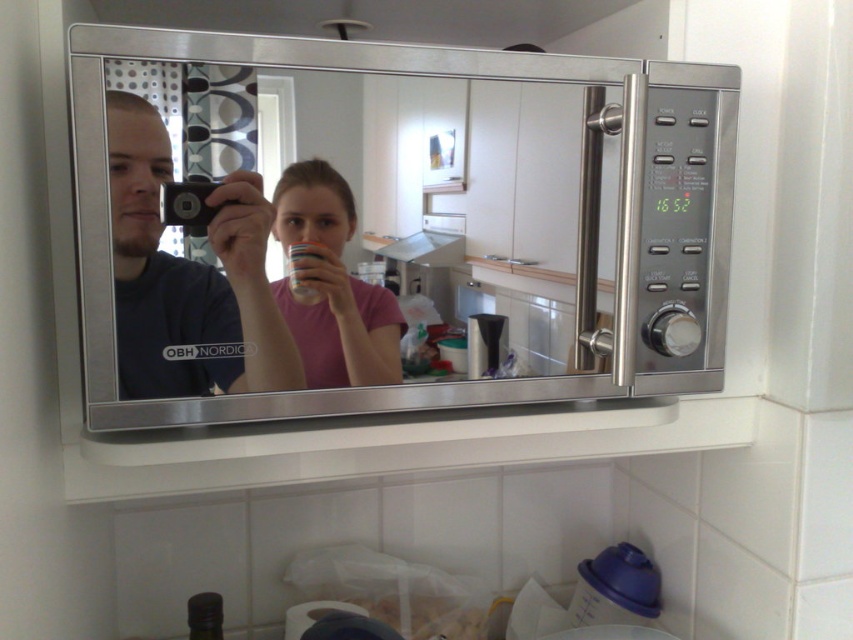
Question: Is matte black camera at center below pink matte shirt at center?

Choices:
 (A) no
 (B) yes

Answer: (A)

Question: Does stainless steel microwave at upper center appear on the left side of white matte cup at upper center?

Choices:
 (A) yes
 (B) no

Answer: (B)

Question: Estimate the real-world distances between objects in this image. Which object is farther from the pink matte shirt at center?

Choices:
 (A) matte black camera at center
 (B) stainless steel microwave at upper center
 (C) white matte cup at upper center

Answer: (B)

Question: Which point is closer to the camera?

Choices:
 (A) pink matte shirt at center
 (B) stainless steel microwave at upper center
 (C) white matte cup at upper center

Answer: (B)

Question: Is stainless steel microwave at upper center positioned in front of matte black camera at center?

Choices:
 (A) no
 (B) yes

Answer: (B)

Question: Which object is farther from the camera taking this photo?

Choices:
 (A) stainless steel microwave at upper center
 (B) pink matte shirt at center

Answer: (B)